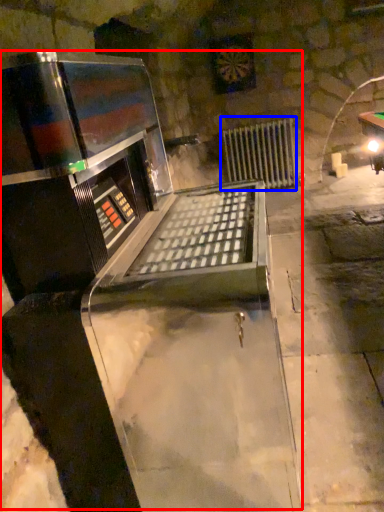
Question: Which object appears farthest to the camera in this image, wine cellar (highlighted by a red box) or radiator (highlighted by a blue box)?

Choices:
 (A) wine cellar
 (B) radiator

Answer: (B)